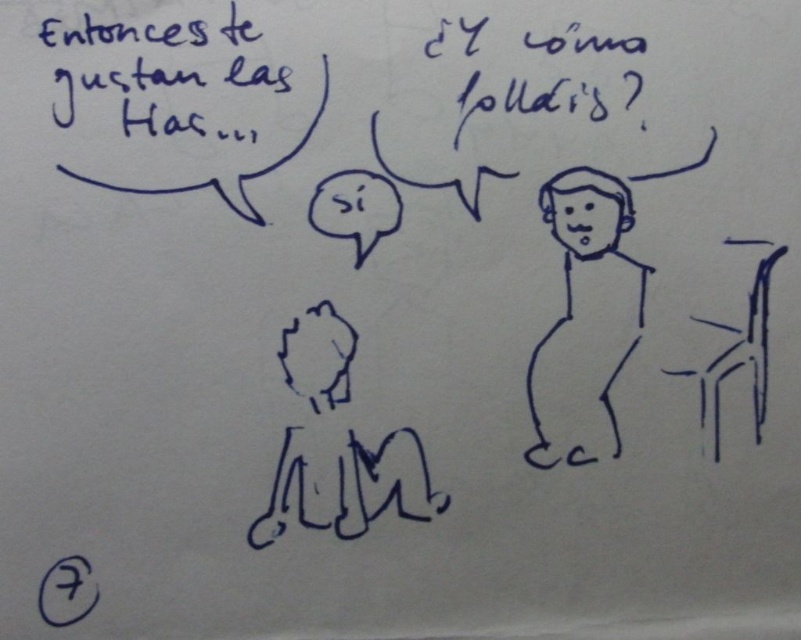
Looking at this image, who is higher up, black handwritten text at upper left or black line drawing of person at center?

Positioned higher is black handwritten text at upper left.

Between point (155, 134) and point (574, 384), which one is positioned behind?

The point (574, 384) is behind.

What are the coordinates of `black handwritten text at upper left` in the screenshot? It's located at (164, 72).

Does smooth black figure at center have a lesser height compared to black plastic chair at right?

Incorrect, smooth black figure at center's height does not fall short of black plastic chair at right's.

Describe the element at coordinates (337, 444) in the screenshot. I see `smooth black figure at center` at that location.

Is point (417, 451) positioned before point (699, 422)?

Yes, it is.

The height and width of the screenshot is (640, 801). What are the coordinates of `smooth black figure at center` in the screenshot? It's located at (337, 444).

Is smooth black figure at center further to the viewer compared to black handwritten text at upper left?

That is True.

Which is below, smooth black figure at center or black handwritten text at upper left?

smooth black figure at center is below.

This screenshot has height=640, width=801. What are the coordinates of `smooth black figure at center` in the screenshot? It's located at [337, 444].